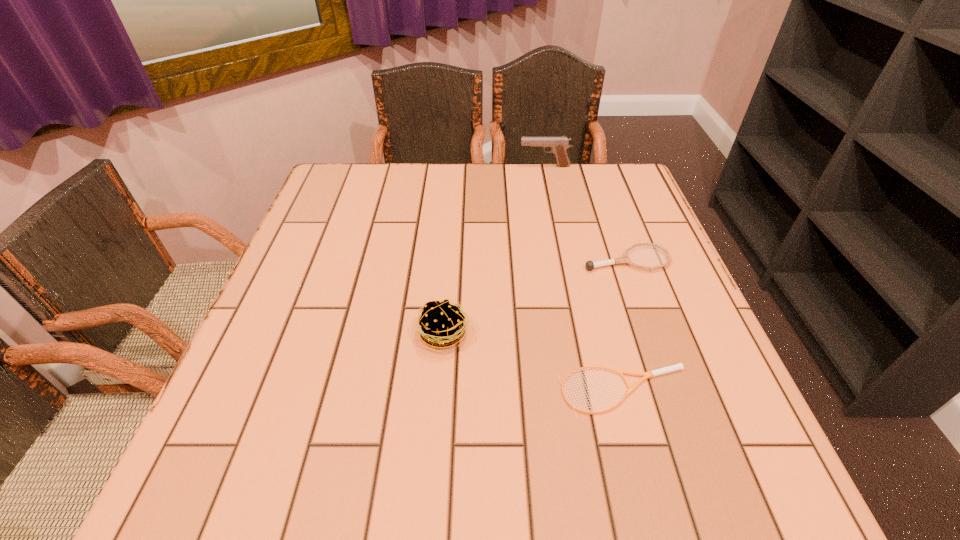
Find the location of a particular element. Image resolution: width=960 pixels, height=540 pixels. the farthest object is located at coordinates (559, 145).

Find the location of a particular element. The width and height of the screenshot is (960, 540). the tallest object is located at coordinates (559, 145).

Identify the location of patty. This screenshot has height=540, width=960. (442, 324).

The height and width of the screenshot is (540, 960). Identify the location of the third farthest object. (442, 324).

What are the coordinates of `the farther tennis racket` in the screenshot? It's located at (590, 265).

You are a GUI agent. You are given a task and a screenshot of the screen. Output one action in this format:
    pyautogui.click(x=<x>, y=<y>)
    Task: Click on the third tallest object
    
    Given the screenshot: What is the action you would take?
    pyautogui.click(x=590, y=265)

Where is `the nearest object`? the nearest object is located at coordinates (650, 374).

You are a GUI agent. You are given a task and a screenshot of the screen. Output one action in this format:
    pyautogui.click(x=<x>, y=<y>)
    Task: Click on the shortest object
    The height and width of the screenshot is (540, 960).
    Given the screenshot: What is the action you would take?
    pyautogui.click(x=650, y=374)

Where is `vacant area situated 0.060m at the barrel of the farthest object`? Image resolution: width=960 pixels, height=540 pixels. vacant area situated 0.060m at the barrel of the farthest object is located at coordinates (499, 166).

Where is `vacant region located at the barrel of the farthest object`? Image resolution: width=960 pixels, height=540 pixels. vacant region located at the barrel of the farthest object is located at coordinates (435, 166).